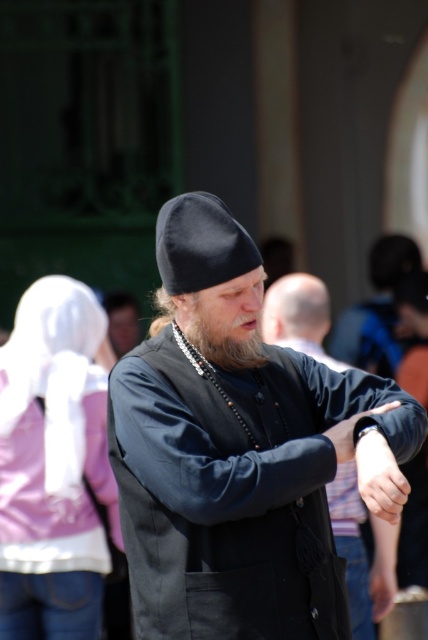
Question: Which point appears farthest from the camera in this image?

Choices:
 (A) (315, 300)
 (B) (264, 612)
 (C) (380, 554)

Answer: (A)

Question: Which point is closer to the camera taking this photo?

Choices:
 (A) (401, 484)
 (B) (225, 330)

Answer: (A)

Question: Considering the relative positions of black matte robe at center and grayish-black beard at center in the image provided, where is black matte robe at center located with respect to grayish-black beard at center?

Choices:
 (A) left
 (B) right

Answer: (B)

Question: Is dark blue fabric coat at center positioned behind smooth skin hand at center?

Choices:
 (A) no
 (B) yes

Answer: (A)

Question: Considering the real-world distances, which object is closest to the black matte robe at center?

Choices:
 (A) smooth leather wristwatch at center
 (B) grayish-black beard at center
 (C) dark blue fabric coat at center

Answer: (B)

Question: In this image, where is black matte robe at center located relative to grayish-black beard at center?

Choices:
 (A) left
 (B) right

Answer: (B)